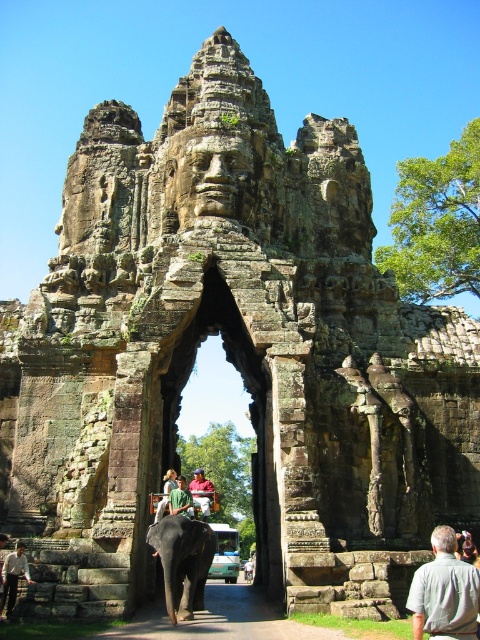
You are standing at the entrance of the ancient temple archway and see a light brown leather jacket at lower left and a green fabric person at center. Which object is positioned more to the left side of the scene?

→ The light brown leather jacket at lower left is positioned to the left of the green fabric person at center, so it is more to the left.

In the scene shown: You are standing at the entrance of the grand stone archway and want to walk to the point marked as point (x=219, y=620). Is this point located on the brown stone path at center?

Yes, the point (x=219, y=620) is on the brown stone path at center, so you can walk directly to it along the path.

You are a photographer planning to take a group photo of the light brown leather jacket at lower left and the green fabric person at center. Which object should you place closer to the camera to ensure both appear roughly the same size in the photo?

Since the light brown leather jacket at lower left is larger in size than the green fabric person at center, you should place the green fabric person at center closer to the camera to balance their sizes in the photo.